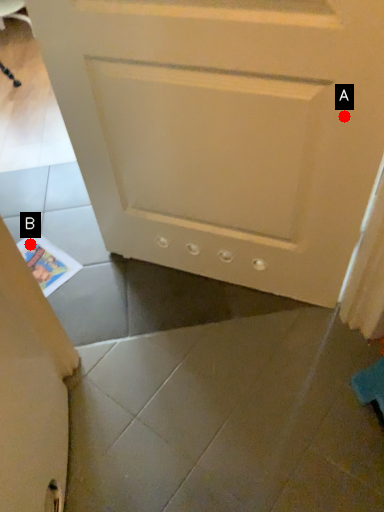
Question: Two points are circled on the image, labeled by A and B beside each circle. Which point is closer to the camera?

Choices:
 (A) A is closer
 (B) B is closer

Answer: (A)